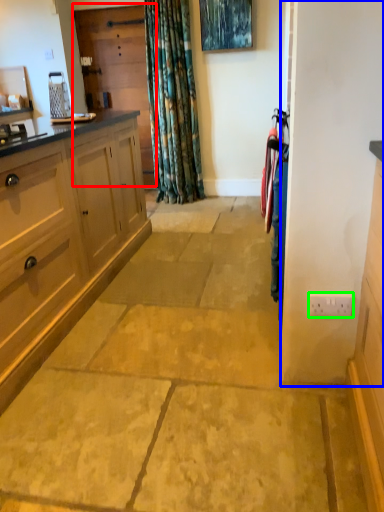
Question: Estimate the real-world distances between objects in this image. Which object is closer to screen door (highlighted by a red box), screen door (highlighted by a blue box) or electric outlet (highlighted by a green box)?

Choices:
 (A) screen door
 (B) electric outlet

Answer: (A)